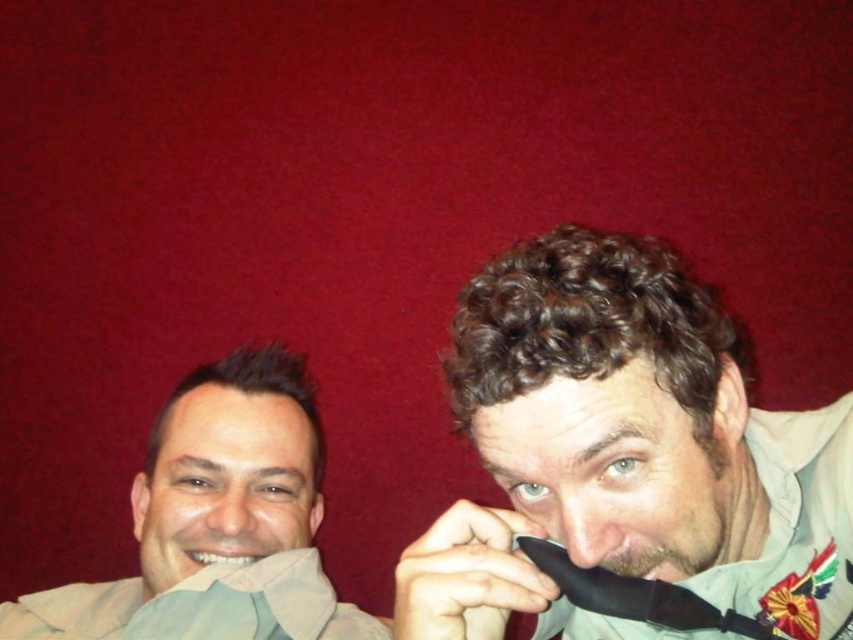
Can you confirm if black matte tie at center is thinner than matte skin nose at center?

No, black matte tie at center is not thinner than matte skin nose at center.

Between black matte tie at center and matte skin nose at center, which one is positioned lower?

matte skin nose at center is below.

Which is behind, point (529, 355) or point (209, 524)?

The point (209, 524) is behind.

The width and height of the screenshot is (853, 640). I want to click on black matte tie at center, so click(628, 451).

Is black matte tie at center below matte beige shirt at left?

No, black matte tie at center is not below matte beige shirt at left.

Between black matte tie at center and matte beige shirt at left, which one is positioned lower?

matte beige shirt at left is lower down.

Describe the element at coordinates (628, 451) in the screenshot. I see `black matte tie at center` at that location.

Image resolution: width=853 pixels, height=640 pixels. In order to click on black matte tie at center in this screenshot , I will do `click(628, 451)`.

Is point (280, 376) in front of point (212, 563)?

No.

Does matte beige shirt at left lie in front of white glossy teeth at lower left?

Yes.

Where is `matte beige shirt at left`? The width and height of the screenshot is (853, 640). matte beige shirt at left is located at coordinates (201, 536).